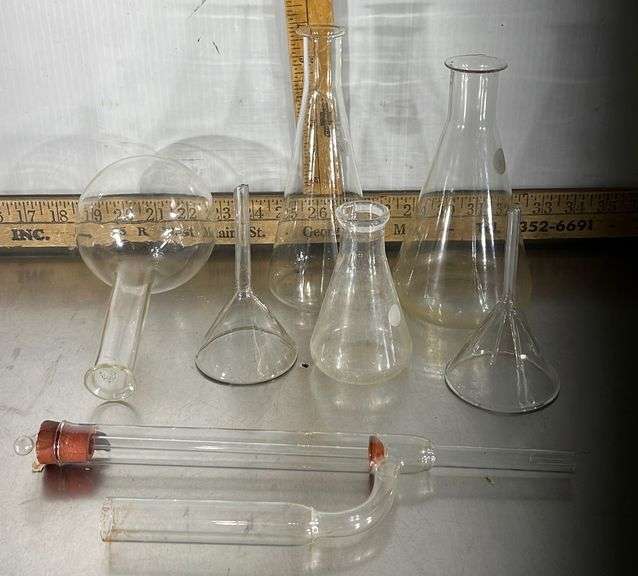
The height and width of the screenshot is (576, 638). What are the coordinates of `flask` in the screenshot? It's located at (389, 333).